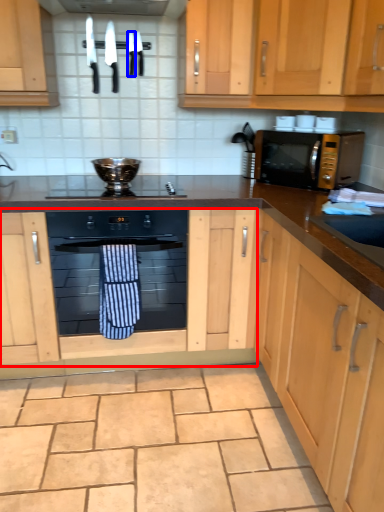
Question: Which object appears farthest to the camera in this image, cabinetry (highlighted by a red box) or knife (highlighted by a blue box)?

Choices:
 (A) cabinetry
 (B) knife

Answer: (B)